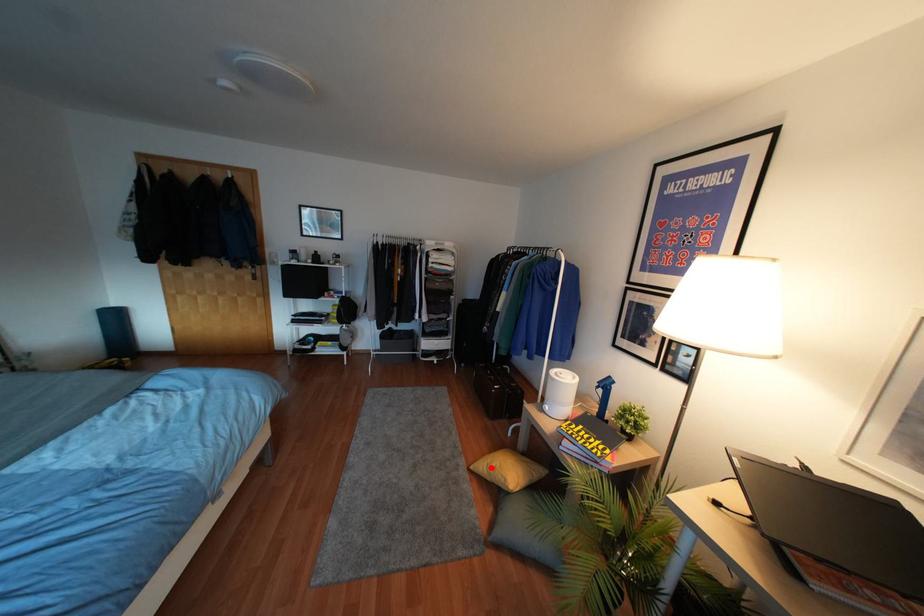
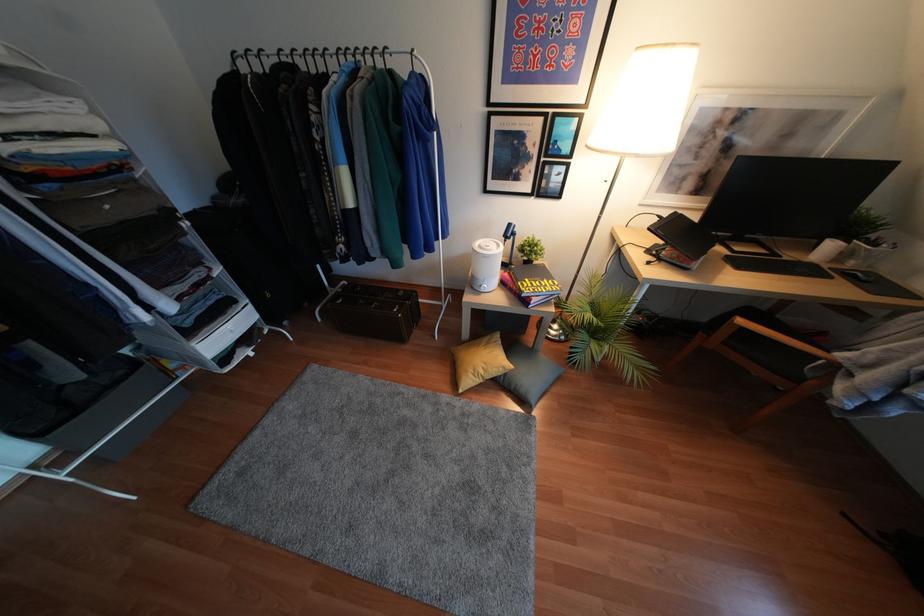
Question: I am providing you with two images of the same scene from different viewpoints. A red point is shown in image1. For the corresponding object point in image2, is it positioned nearer or farther from the camera?

Choices:
 (A) Nearer
 (B) Farther

Answer: (B)